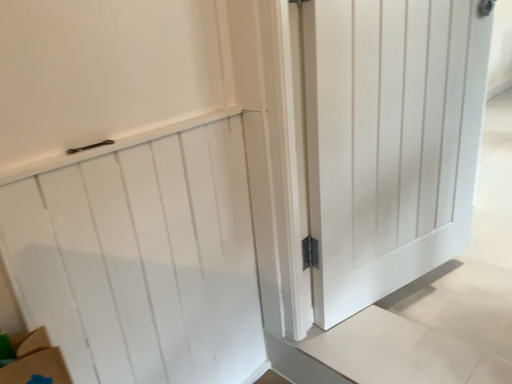
At what (x,y) coordinates should I click in order to perform the action: click on white wood door at center, marked as the first door in a right-to-left arrangement. Please return your answer as a coordinate pair (x, y). Looking at the image, I should click on (389, 141).

This screenshot has width=512, height=384. What do you see at coordinates (389, 141) in the screenshot?
I see `white wood door at center, which ranks as the 2th door in left-to-right order` at bounding box center [389, 141].

The height and width of the screenshot is (384, 512). Describe the element at coordinates (129, 190) in the screenshot. I see `white wood door at upper left, positioned as the second door in right-to-left order` at that location.

I want to click on white wood door at upper left, which is the 1th door from left to right, so click(x=129, y=190).

What are the coordinates of `white wood door at center, marked as the first door in a right-to-left arrangement` in the screenshot? It's located at (389, 141).

Does white wood door at center, which ranks as the 2th door in left-to-right order, appear on the right side of white wood door at upper left, which is the 1th door from left to right?

Indeed, white wood door at center, which ranks as the 2th door in left-to-right order, is positioned on the right side of white wood door at upper left, which is the 1th door from left to right.

Relative to white wood door at upper left, which is the 1th door from left to right, is white wood door at center, marked as the first door in a right-to-left arrangement, in front or behind?

white wood door at center, marked as the first door in a right-to-left arrangement, is behind white wood door at upper left, which is the 1th door from left to right.

Does point (422, 127) appear closer or farther from the camera than point (38, 147)?

Point (422, 127) appears to be farther away from the viewer than point (38, 147).

From the image's perspective, is white wood door at center, marked as the first door in a right-to-left arrangement, located above or below white wood door at upper left, positioned as the second door in right-to-left order?

Based on their image positions, white wood door at center, marked as the first door in a right-to-left arrangement, is located above white wood door at upper left, positioned as the second door in right-to-left order.

From a real-world perspective, is white wood door at center, which ranks as the 2th door in left-to-right order, physically below white wood door at upper left, which is the 1th door from left to right?

No, from a real-world perspective, white wood door at center, which ranks as the 2th door in left-to-right order, is not under white wood door at upper left, which is the 1th door from left to right.

Considering the relative sizes of white wood door at center, marked as the first door in a right-to-left arrangement, and white wood door at upper left, positioned as the second door in right-to-left order, in the image provided, is white wood door at center, marked as the first door in a right-to-left arrangement, thinner than white wood door at upper left, positioned as the second door in right-to-left order,?

Incorrect, the width of white wood door at center, marked as the first door in a right-to-left arrangement, is not less than that of white wood door at upper left, positioned as the second door in right-to-left order.

Is white wood door at center, which ranks as the 2th door in left-to-right order, shorter than white wood door at upper left, positioned as the second door in right-to-left order?

No.

Is white wood door at center, which ranks as the 2th door in left-to-right order, bigger than white wood door at upper left, which is the 1th door from left to right?

Yes.

Is white wood door at center, marked as the first door in a right-to-left arrangement, located outside white wood door at upper left, positioned as the second door in right-to-left order?

Indeed, white wood door at center, marked as the first door in a right-to-left arrangement, is completely outside white wood door at upper left, positioned as the second door in right-to-left order.

Are white wood door at center, marked as the first door in a right-to-left arrangement, and white wood door at upper left, which is the 1th door from left to right, located far from each other?

No, white wood door at center, marked as the first door in a right-to-left arrangement, is in close proximity to white wood door at upper left, which is the 1th door from left to right.

Could you tell me if white wood door at center, marked as the first door in a right-to-left arrangement, is facing white wood door at upper left, positioned as the second door in right-to-left order?

No, white wood door at center, marked as the first door in a right-to-left arrangement, is not facing towards white wood door at upper left, positioned as the second door in right-to-left order.

What's the angular difference between white wood door at center, marked as the first door in a right-to-left arrangement, and white wood door at upper left, positioned as the second door in right-to-left order,'s facing directions?

The angle between the facing direction of white wood door at center, marked as the first door in a right-to-left arrangement, and the facing direction of white wood door at upper left, positioned as the second door in right-to-left order, is 11.3 degrees.

Where is `door directly beneath the white wood door at center, which ranks as the 2th door in left-to-right order (from a real-world perspective)`? Image resolution: width=512 pixels, height=384 pixels. door directly beneath the white wood door at center, which ranks as the 2th door in left-to-right order (from a real-world perspective) is located at coordinates (129, 190).

Is white wood door at upper left, which is the 1th door from left to right, at the right side of white wood door at center, marked as the first door in a right-to-left arrangement?

No, white wood door at upper left, which is the 1th door from left to right, is not to the right of white wood door at center, marked as the first door in a right-to-left arrangement.

Is white wood door at upper left, which is the 1th door from left to right, positioned behind white wood door at center, which ranks as the 2th door in left-to-right order?

No, white wood door at upper left, which is the 1th door from left to right, is closer to the viewer.

Which point is more distant from viewer, (182, 90) or (476, 102)?

The point (476, 102) is behind.

From the image's perspective, between white wood door at upper left, positioned as the second door in right-to-left order, and white wood door at center, marked as the first door in a right-to-left arrangement, who is located below?

white wood door at upper left, positioned as the second door in right-to-left order, is shown below in the image.

From a real-world perspective, which is physically below, white wood door at upper left, which is the 1th door from left to right, or white wood door at center, which ranks as the 2th door in left-to-right order?

white wood door at upper left, which is the 1th door from left to right, is physically lower.

Considering the sizes of white wood door at upper left, which is the 1th door from left to right, and white wood door at center, which ranks as the 2th door in left-to-right order, in the image, is white wood door at upper left, which is the 1th door from left to right, wider or thinner than white wood door at center, which ranks as the 2th door in left-to-right order,?

Clearly, white wood door at upper left, which is the 1th door from left to right, has less width compared to white wood door at center, which ranks as the 2th door in left-to-right order.

Between white wood door at upper left, positioned as the second door in right-to-left order, and white wood door at center, marked as the first door in a right-to-left arrangement, which one has more height?

Standing taller between the two is white wood door at center, marked as the first door in a right-to-left arrangement.

In the scene shown: Who is bigger, white wood door at upper left, positioned as the second door in right-to-left order, or white wood door at center, marked as the first door in a right-to-left arrangement?

white wood door at center, marked as the first door in a right-to-left arrangement, is bigger.

Is white wood door at upper left, positioned as the second door in right-to-left order, spatially inside white wood door at center, which ranks as the 2th door in left-to-right order, or outside of it?

white wood door at upper left, positioned as the second door in right-to-left order, exists outside the volume of white wood door at center, which ranks as the 2th door in left-to-right order.

Can you see white wood door at upper left, positioned as the second door in right-to-left order, touching white wood door at center, marked as the first door in a right-to-left arrangement?

No, white wood door at upper left, positioned as the second door in right-to-left order, is not beside white wood door at center, marked as the first door in a right-to-left arrangement.

Could you tell me if white wood door at upper left, which is the 1th door from left to right, is facing white wood door at center, which ranks as the 2th door in left-to-right order?

No, white wood door at upper left, which is the 1th door from left to right, is not turned towards white wood door at center, which ranks as the 2th door in left-to-right order.

The image size is (512, 384). What are the coordinates of `door behind the white wood door at upper left, which is the 1th door from left to right` in the screenshot? It's located at (389, 141).

Where is `door below the white wood door at center, which ranks as the 2th door in left-to-right order (from a real-world perspective)`? The height and width of the screenshot is (384, 512). door below the white wood door at center, which ranks as the 2th door in left-to-right order (from a real-world perspective) is located at coordinates (129, 190).

This screenshot has width=512, height=384. Identify the location of door on the right of the white wood door at upper left, which is the 1th door from left to right. (389, 141).